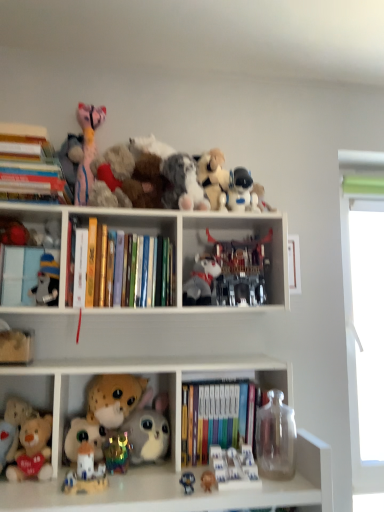
Question: From the image's perspective, is white matte bookshelf at upper center, positioned as the second shelf in bottom-to-top order, under rainbow plastic toy at lower center, arranged as the 8th toy when viewed from the right?

Choices:
 (A) yes
 (B) no

Answer: (B)

Question: Is white matte bookshelf at upper center, the 1th shelf positioned from the top, outside of rainbow plastic toy at lower center, the seventh toy in the left-to-right sequence?

Choices:
 (A) no
 (B) yes

Answer: (B)

Question: Does white matte bookshelf at upper center, positioned as the second shelf in bottom-to-top order, come behind rainbow plastic toy at lower center, arranged as the 8th toy when viewed from the right?

Choices:
 (A) yes
 (B) no

Answer: (B)

Question: Can you confirm if white matte bookshelf at upper center, positioned as the second shelf in bottom-to-top order, is positioned to the right of rainbow plastic toy at lower center, arranged as the 8th toy when viewed from the right?

Choices:
 (A) yes
 (B) no

Answer: (A)

Question: Considering the relative sizes of white matte bookshelf at upper center, the 1th shelf positioned from the top, and rainbow plastic toy at lower center, the seventh toy in the left-to-right sequence, in the image provided, is white matte bookshelf at upper center, the 1th shelf positioned from the top, shorter than rainbow plastic toy at lower center, the seventh toy in the left-to-right sequence,?

Choices:
 (A) no
 (B) yes

Answer: (A)

Question: From the image's perspective, is hardcover book at upper left, which appears as the 1th book when viewed from the left, positioned above or below white matte cards at lower center, the 4th toy positioned from the right?

Choices:
 (A) above
 (B) below

Answer: (A)

Question: Relative to white matte cards at lower center, the 4th toy positioned from the right, is hardcover book at upper left, which is the first book in top-to-bottom order, in front or behind?

Choices:
 (A) behind
 (B) front

Answer: (A)

Question: In terms of height, does hardcover book at upper left, which is the first book in top-to-bottom order, look taller or shorter compared to white matte cards at lower center, the eleventh toy from the left?

Choices:
 (A) tall
 (B) short

Answer: (A)

Question: Would you say hardcover book at upper left, which appears as the third book when ordered from the bottom, is to the left or to the right of white matte cards at lower center, the eleventh toy from the left, in the picture?

Choices:
 (A) right
 (B) left

Answer: (B)

Question: Is point (28, 330) positioned closer to the camera than point (185, 198)?

Choices:
 (A) farther
 (B) closer

Answer: (A)

Question: Choose the correct answer: Is fuzzy beige stuffed animal at lower left, which is the 14th toy in right-to-left order, inside fluffy plush toy at upper center, arranged as the 8th toy when viewed from the left, or outside it?

Choices:
 (A) outside
 (B) inside

Answer: (A)

Question: From a real-world perspective, relative to fluffy plush toy at upper center, arranged as the 8th toy when viewed from the left, is fuzzy beige stuffed animal at lower left, which is the 14th toy in right-to-left order, vertically above or below?

Choices:
 (A) above
 (B) below

Answer: (B)

Question: From the image's perspective, is fuzzy beige stuffed animal at lower left, which is the 14th toy in right-to-left order, located above or below fluffy plush toy at upper center, arranged as the 8th toy when viewed from the left?

Choices:
 (A) above
 (B) below

Answer: (B)

Question: Is fluffy beige teddy bear at lower left, acting as the first shelf starting from the bottom, taller or shorter than transparent glass vase at lower right, which is counted as the 14th toy, starting from the left?

Choices:
 (A) short
 (B) tall

Answer: (A)

Question: Based on their positions, is fluffy beige teddy bear at lower left, acting as the first shelf starting from the bottom, located to the left or right of transparent glass vase at lower right, placed as the first toy when sorted from right to left?

Choices:
 (A) right
 (B) left

Answer: (B)